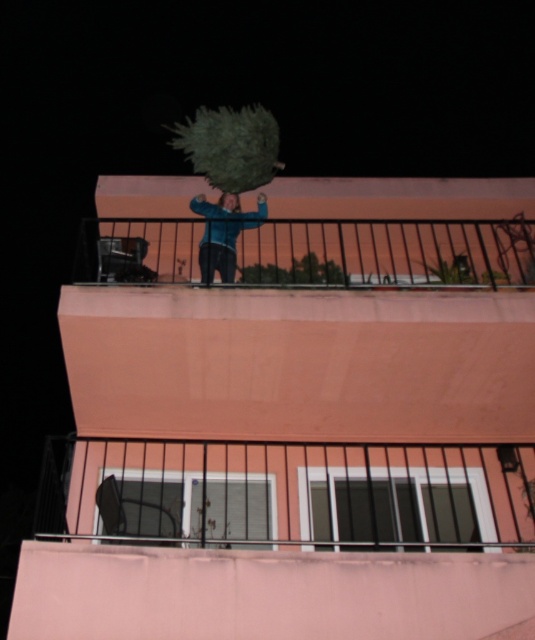
Question: Estimate the real-world distances between objects in this image. Which object is closer to the metallic balcony railing at upper center?

Choices:
 (A) green matte tree at center
 (B) blue denim jacket at center

Answer: (B)

Question: Does metallic balcony railing at upper center appear under green matte tree at center?

Choices:
 (A) no
 (B) yes

Answer: (B)

Question: Which of the following is the farthest from the observer?

Choices:
 (A) metallic balcony railing at upper center
 (B) green matte tree at center
 (C) blue denim jacket at center

Answer: (B)

Question: Estimate the real-world distances between objects in this image. Which object is closer to the green matte tree at center?

Choices:
 (A) metallic balcony railing at upper center
 (B) blue denim jacket at center

Answer: (B)

Question: Is metallic balcony railing at upper center further to camera compared to green matte tree at center?

Choices:
 (A) no
 (B) yes

Answer: (A)

Question: Considering the relative positions of green matte tree at center and blue denim jacket at center in the image provided, where is green matte tree at center located with respect to blue denim jacket at center?

Choices:
 (A) left
 (B) right

Answer: (B)